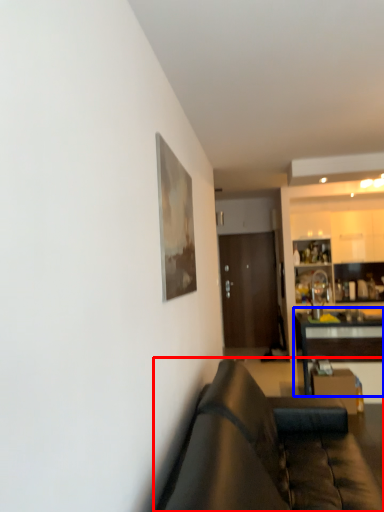
Question: Which object is closer to the camera taking this photo, studio couch (highlighted by a red box) or table (highlighted by a blue box)?

Choices:
 (A) studio couch
 (B) table

Answer: (A)